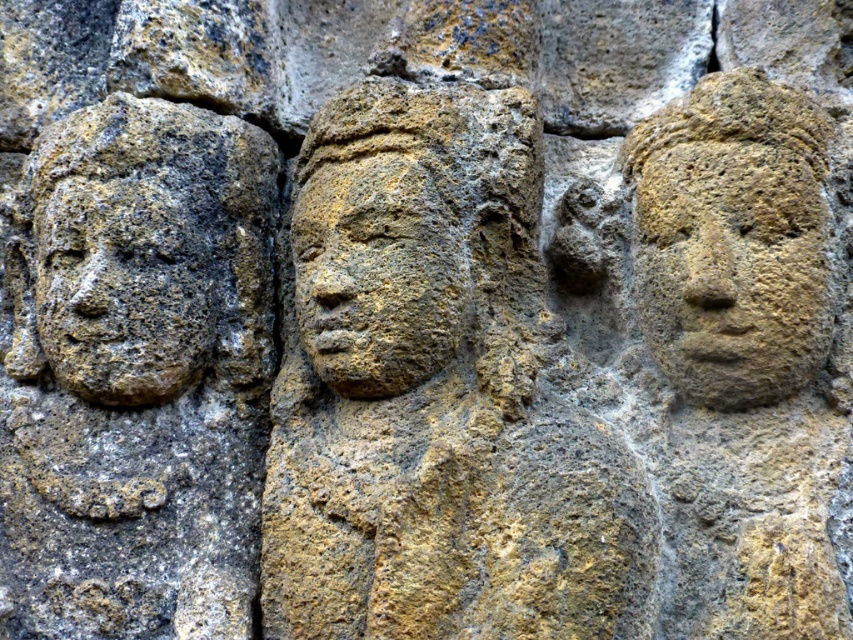
Looking at the scene described, which object is positioned to the left of the other between the yellow stone face at center and the earthy stone carving at center?

The yellow stone face at center is positioned to the left of the earthy stone carving at center.